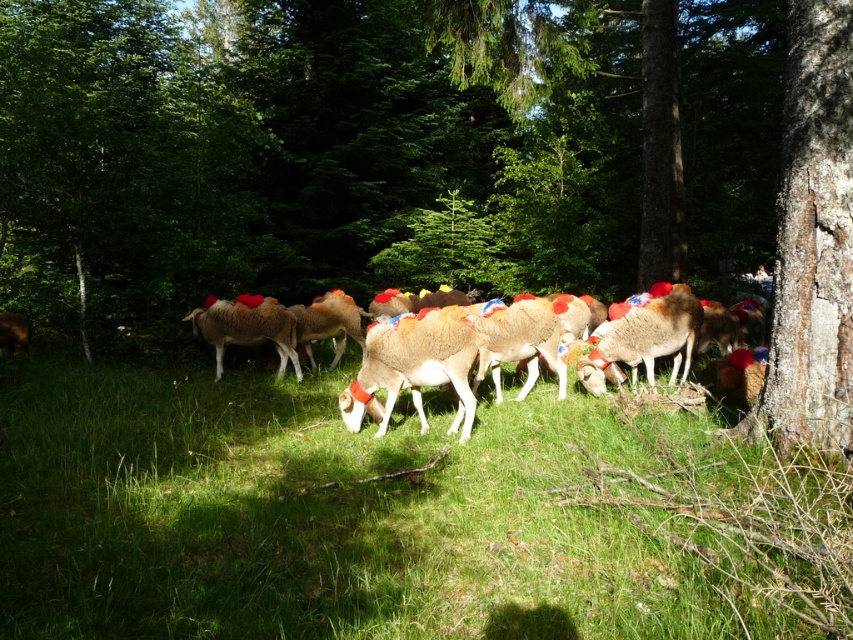
This screenshot has width=853, height=640. Describe the element at coordinates (428, 161) in the screenshot. I see `brown rough tree at center-right` at that location.

Is brown rough tree at center-right below light brown woolen sheep at center?

Actually, brown rough tree at center-right is above light brown woolen sheep at center.

This screenshot has width=853, height=640. Find the location of `brown rough tree at center-right`. brown rough tree at center-right is located at coordinates (428, 161).

In the scene shown: Between green grassy at center and light brown woolen goat at center, which one is positioned lower?

green grassy at center

Who is more distant from viewer, (637,433) or (426,308)?

Point (426,308)

The width and height of the screenshot is (853, 640). I want to click on green grassy at center, so click(x=392, y=516).

Who is shorter, brown rough tree at center-right or light brown woolen goat at center?

light brown woolen goat at center

Between brown rough tree at center-right and light brown woolen goat at center, which one is positioned lower?

light brown woolen goat at center

The width and height of the screenshot is (853, 640). What do you see at coordinates (428, 161) in the screenshot? I see `brown rough tree at center-right` at bounding box center [428, 161].

The height and width of the screenshot is (640, 853). I want to click on brown rough tree at center-right, so click(428, 161).